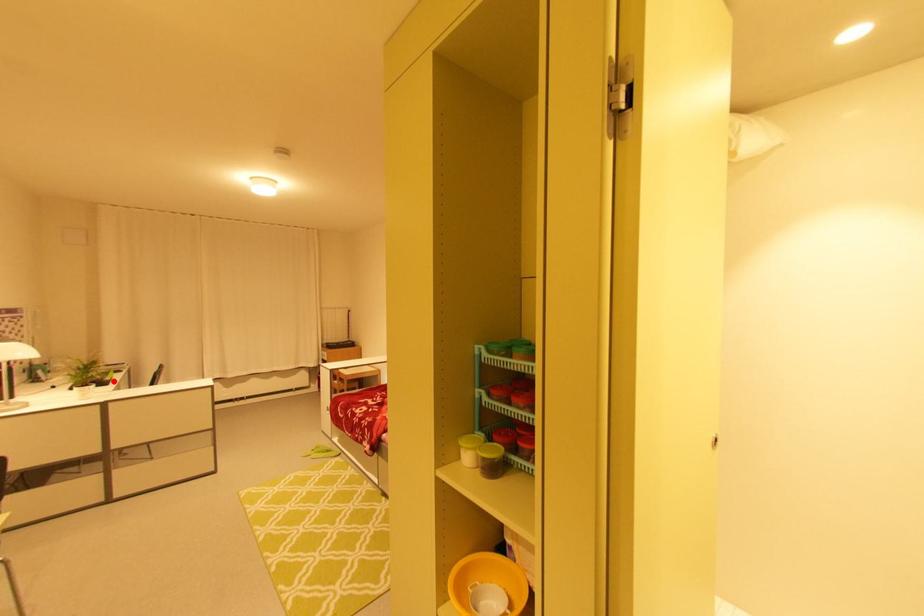
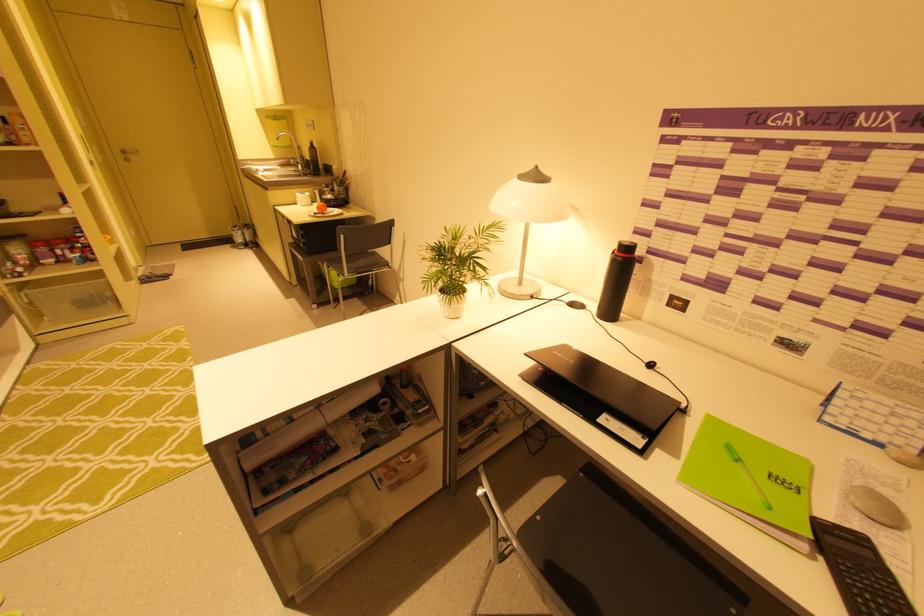
The point at the highlighted location is marked in the first image. Where is the corresponding point in the second image?

(596, 419)